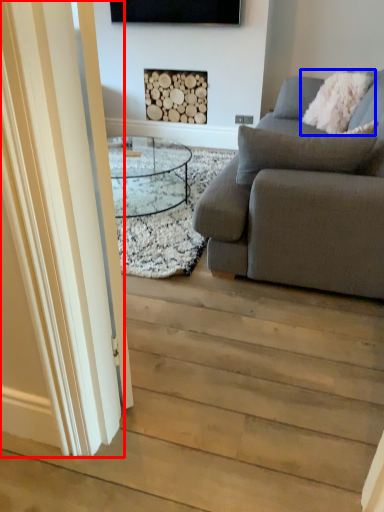
Question: Which of the following is the farthest to the observer, glass door (highlighted by a red box) or pillow (highlighted by a blue box)?

Choices:
 (A) glass door
 (B) pillow

Answer: (B)